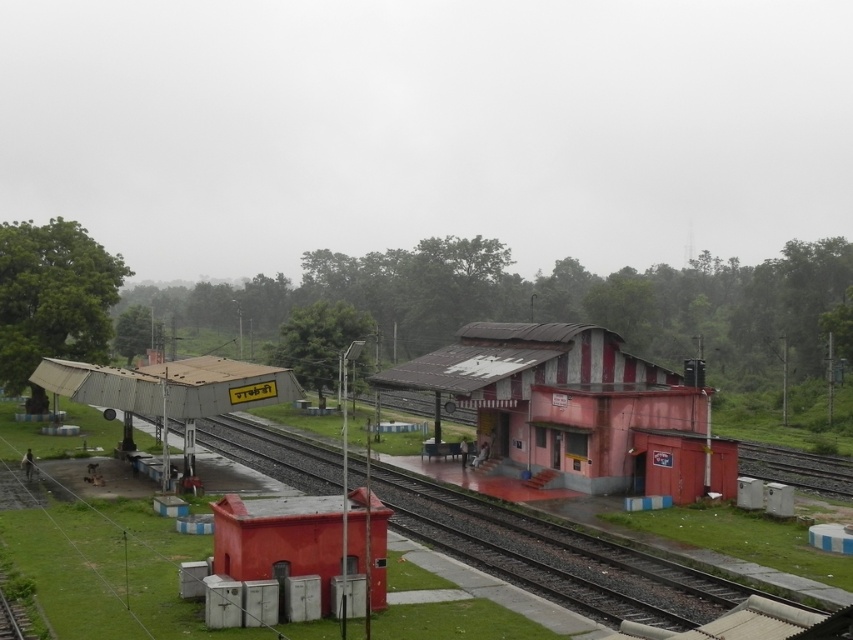
Can you confirm if smooth concrete train track at center is smaller than smooth red utility box at lower left?

Actually, smooth concrete train track at center might be larger than smooth red utility box at lower left.

In the scene shown: Who is more distant from viewer, (485,509) or (254,563)?

The point (485,509) is more distant.

At what (x,y) coordinates should I click in order to perform the action: click on smooth concrete train track at center. Please return your answer as a coordinate pair (x, y). Looking at the image, I should click on (556, 556).

The image size is (853, 640). I want to click on smooth concrete train track at center, so click(556, 556).

This screenshot has height=640, width=853. Describe the element at coordinates (577, 410) in the screenshot. I see `rusty metal railway station at center` at that location.

Is the position of rusty metal railway station at center less distant than that of smooth concrete train track at center?

No, it is not.

Who is more forward, (647, 387) or (202, 442)?

Point (647, 387)

The height and width of the screenshot is (640, 853). In order to click on rusty metal railway station at center in this screenshot , I will do `click(577, 410)`.

Consider the image. Is rusty metal railway station at center thinner than smooth red utility box at lower left?

In fact, rusty metal railway station at center might be wider than smooth red utility box at lower left.

Is rusty metal railway station at center to the right of smooth red utility box at lower left from the viewer's perspective?

Correct, you'll find rusty metal railway station at center to the right of smooth red utility box at lower left.

Which is in front, point (524, 424) or point (384, 600)?

Positioned in front is point (384, 600).

Find the location of a particular element. The width and height of the screenshot is (853, 640). rusty metal railway station at center is located at coordinates (577, 410).